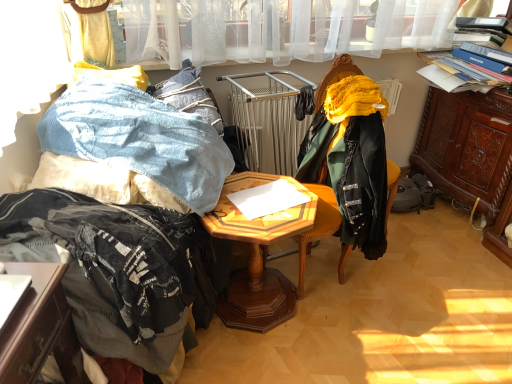
I want to click on vacant space to the right of woodenobject at center, so click(x=360, y=324).